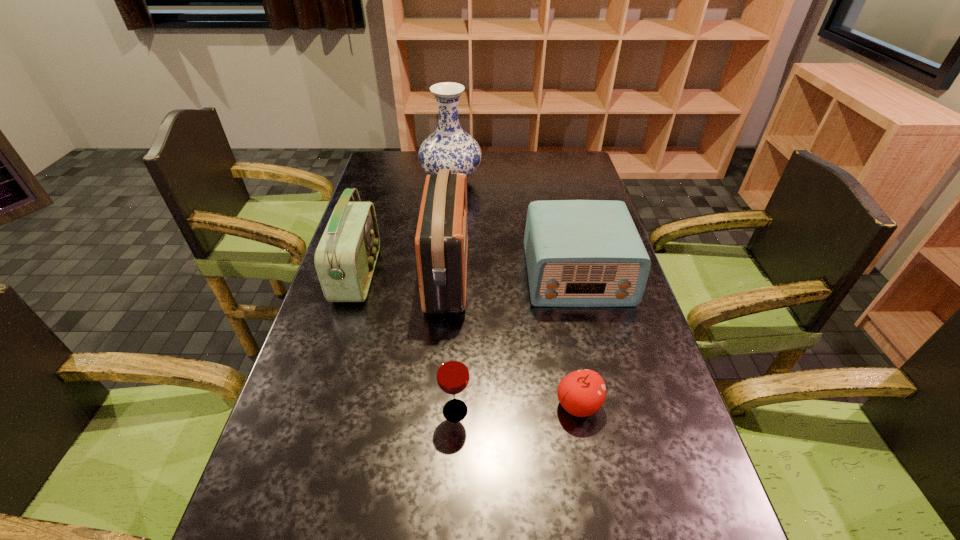
Where is `blank space at the right edge`? The image size is (960, 540). blank space at the right edge is located at coordinates (555, 187).

Find the location of a particular element. vacant region at the far right corner is located at coordinates (576, 154).

Where is `free space between the shortest radio receiver and the second tallest object`? The height and width of the screenshot is (540, 960). free space between the shortest radio receiver and the second tallest object is located at coordinates (513, 275).

Locate an element on the screen. This screenshot has height=540, width=960. free point between the glass and the second radio receiver from left to right is located at coordinates (451, 343).

Identify the location of free space between the shortest object and the glass. Image resolution: width=960 pixels, height=540 pixels. (516, 408).

Where is `free area in between the second tallest radio receiver and the apple`? The image size is (960, 540). free area in between the second tallest radio receiver and the apple is located at coordinates (468, 340).

The width and height of the screenshot is (960, 540). Find the location of `vacant space that is in between the vase and the apple`. vacant space that is in between the vase and the apple is located at coordinates (515, 293).

The height and width of the screenshot is (540, 960). I want to click on empty space that is in between the glass and the second radio receiver from left to right, so click(x=451, y=343).

The image size is (960, 540). I want to click on empty space that is in between the tallest radio receiver and the glass, so click(451, 343).

Find the location of a particular element. empty location between the apple and the rightmost radio receiver is located at coordinates (578, 340).